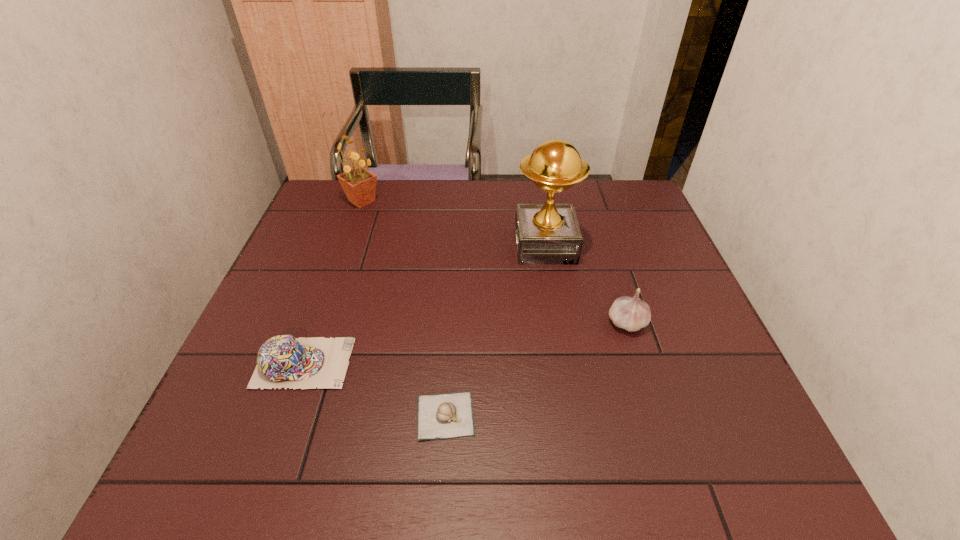
The height and width of the screenshot is (540, 960). I want to click on cap that is at the left edge, so click(x=283, y=361).

What are the coordinates of `object that is positioned at the right edge` in the screenshot? It's located at (631, 313).

At what (x,y) coordinates should I click in order to perform the action: click on object located at the far left corner. Please return your answer as a coordinate pair (x, y). The height and width of the screenshot is (540, 960). Looking at the image, I should click on (359, 184).

Identify the location of blank space at the far edge of the desktop. (524, 191).

Locate an element on the screen. The width and height of the screenshot is (960, 540). free region at the near edge of the desktop is located at coordinates (679, 455).

Find the location of a particular element. vacant space at the left edge of the desktop is located at coordinates (280, 301).

The image size is (960, 540). In order to click on free space at the right edge in this screenshot , I will do `click(662, 288)`.

Identify the location of vacant space at the far left corner of the desktop. Image resolution: width=960 pixels, height=540 pixels. (336, 216).

In the image, there is a desktop. Where is `vacant space at the far right corner`? vacant space at the far right corner is located at coordinates (624, 181).

Identify the location of vacant area at the near right corner of the desktop. (696, 440).